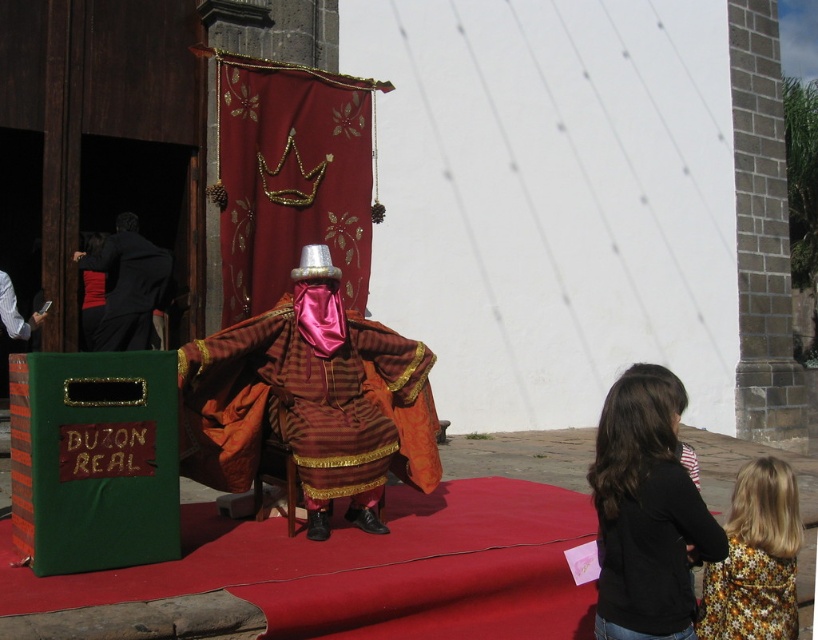
Question: Does shiny silk robe at center appear on the left side of velvet black dress at left?

Choices:
 (A) yes
 (B) no

Answer: (B)

Question: Which of the following is the farthest from the observer?

Choices:
 (A) floral fabric dress at lower right
 (B) shiny silk robe at center
 (C) black cotton shirt at lower right

Answer: (B)

Question: Which of the following is the closest to the observer?

Choices:
 (A) (286, 352)
 (B) (614, 493)
 (C) (101, 304)

Answer: (B)

Question: Which object appears closest to the camera in this image?

Choices:
 (A) black velvet robe at left
 (B) shiny silk robe at center

Answer: (B)

Question: Observing the image, what is the correct spatial positioning of shiny silk robe at center in reference to black velvet robe at left?

Choices:
 (A) below
 (B) above

Answer: (A)

Question: Is the position of floral fabric dress at lower right more distant than that of black velvet robe at left?

Choices:
 (A) no
 (B) yes

Answer: (A)